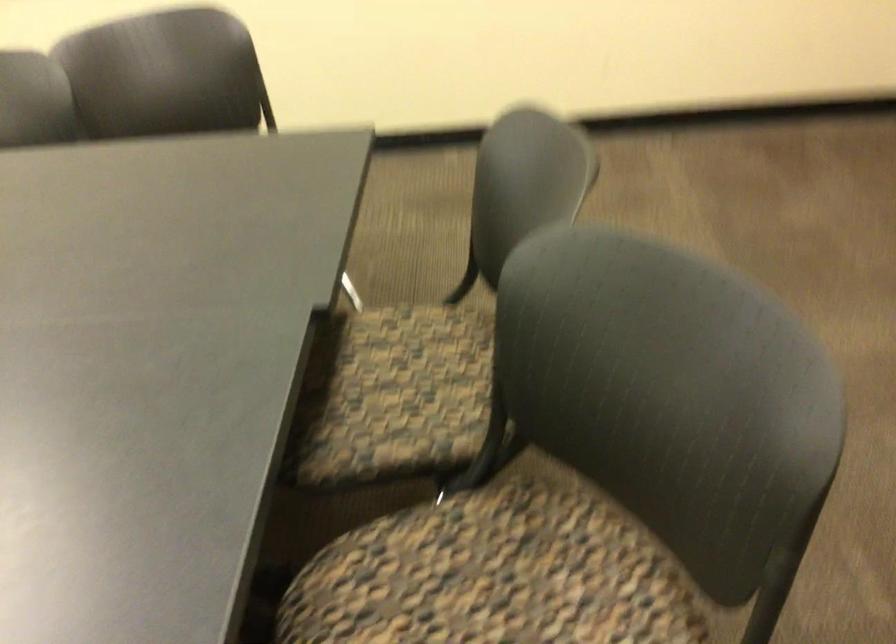
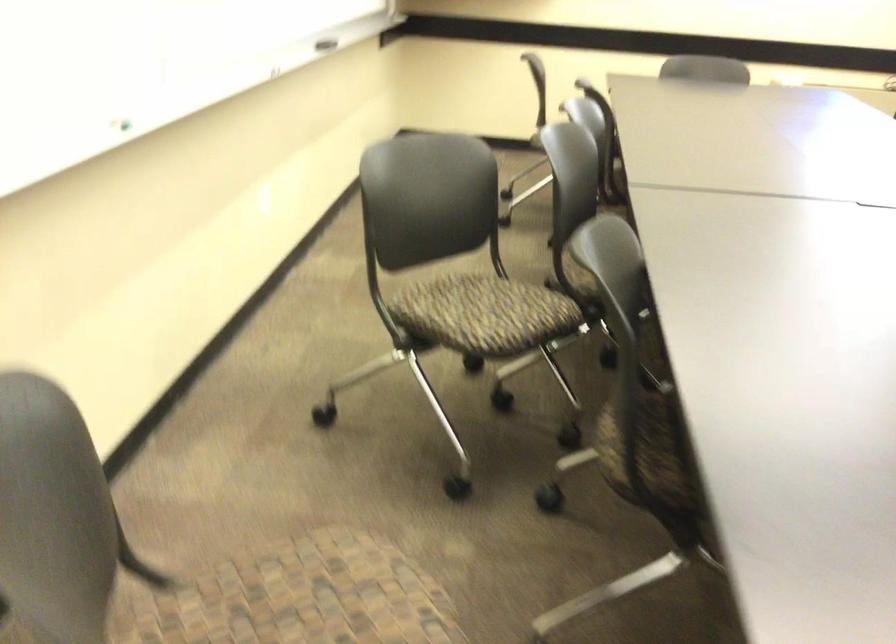
Based on the continuous images, in which direction is the camera rotating?

The camera's rotation is toward left-down.